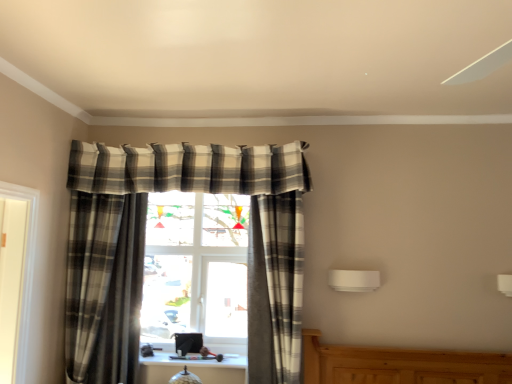
Question: Can you confirm if plaid fabric curtain at right, placed as the second curtain when sorted from left to right, is positioned to the left of plaid fabric curtain at center, the first curtain positioned from the left?

Choices:
 (A) no
 (B) yes

Answer: (A)

Question: Is plaid fabric curtain at right, arranged as the 1th curtain when viewed from the right, taller than plaid fabric curtain at center, the 2th curtain in the right-to-left sequence?

Choices:
 (A) no
 (B) yes

Answer: (A)

Question: Is plaid fabric curtain at right, placed as the second curtain when sorted from left to right, bigger than plaid fabric curtain at center, the 2th curtain in the right-to-left sequence?

Choices:
 (A) no
 (B) yes

Answer: (B)

Question: Considering the relative sizes of plaid fabric curtain at right, arranged as the 1th curtain when viewed from the right, and plaid fabric curtain at center, the 2th curtain in the right-to-left sequence, in the image provided, is plaid fabric curtain at right, arranged as the 1th curtain when viewed from the right, shorter than plaid fabric curtain at center, the 2th curtain in the right-to-left sequence,?

Choices:
 (A) no
 (B) yes

Answer: (B)

Question: Can plaid fabric curtain at center, the 2th curtain in the right-to-left sequence, be found inside plaid fabric curtain at right, arranged as the 1th curtain when viewed from the right?

Choices:
 (A) yes
 (B) no

Answer: (B)

Question: From the image's perspective, does plaid fabric curtain at right, placed as the second curtain when sorted from left to right, appear higher than plaid fabric curtain at center, the first curtain positioned from the left?

Choices:
 (A) no
 (B) yes

Answer: (A)

Question: Considering the relative positions of plaid fabric curtain at center, the 2th curtain in the right-to-left sequence, and plaid fabric curtain at right, placed as the second curtain when sorted from left to right, in the image provided, is plaid fabric curtain at center, the 2th curtain in the right-to-left sequence, to the right of plaid fabric curtain at right, placed as the second curtain when sorted from left to right, from the viewer's perspective?

Choices:
 (A) yes
 (B) no

Answer: (B)

Question: Is plaid fabric curtain at center, the 2th curtain in the right-to-left sequence, at the left side of plaid fabric curtain at right, placed as the second curtain when sorted from left to right?

Choices:
 (A) yes
 (B) no

Answer: (A)

Question: Can you confirm if plaid fabric curtain at center, the first curtain positioned from the left, is bigger than plaid fabric curtain at right, placed as the second curtain when sorted from left to right?

Choices:
 (A) yes
 (B) no

Answer: (B)

Question: From the image's perspective, is plaid fabric curtain at center, the 2th curtain in the right-to-left sequence, above plaid fabric curtain at right, arranged as the 1th curtain when viewed from the right?

Choices:
 (A) yes
 (B) no

Answer: (A)

Question: Does plaid fabric curtain at center, the 2th curtain in the right-to-left sequence, have a greater height compared to plaid fabric curtain at right, placed as the second curtain when sorted from left to right?

Choices:
 (A) yes
 (B) no

Answer: (A)

Question: Does plaid fabric curtain at center, the first curtain positioned from the left, come in front of plaid fabric curtain at right, placed as the second curtain when sorted from left to right?

Choices:
 (A) yes
 (B) no

Answer: (A)

Question: From their relative heights in the image, would you say plaid fabric curtain at center, the first curtain positioned from the left, is taller or shorter than plaid fabric curtain at right, placed as the second curtain when sorted from left to right?

Choices:
 (A) short
 (B) tall

Answer: (B)